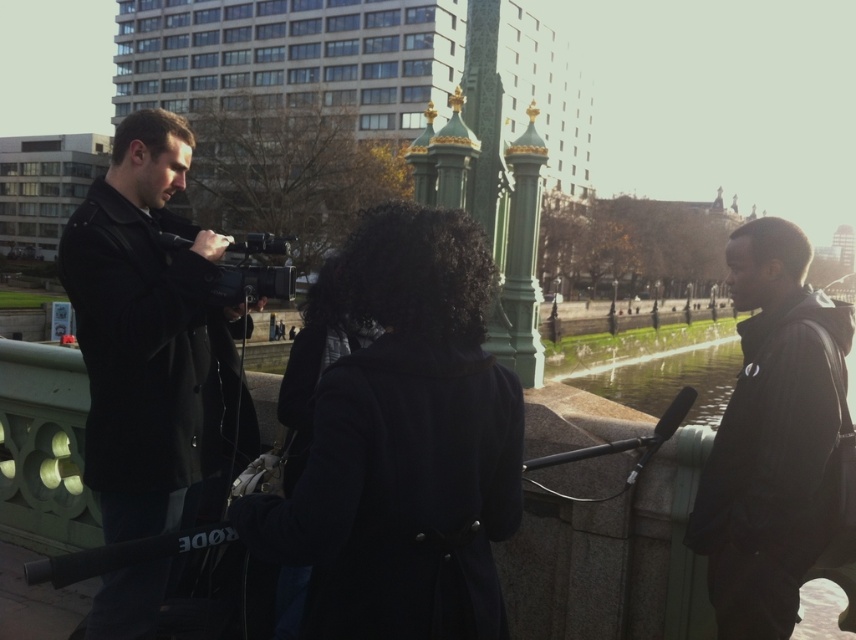
Can you confirm if black matte jacket at right is positioned to the left of black matte video camera at center?

No, black matte jacket at right is not to the left of black matte video camera at center.

Is point (736, 252) closer to camera compared to point (290, 237)?

That is True.

Where is `black matte jacket at right`? The height and width of the screenshot is (640, 856). black matte jacket at right is located at coordinates (771, 436).

Image resolution: width=856 pixels, height=640 pixels. I want to click on black matte jacket at right, so click(x=771, y=436).

Can you confirm if black leather jacket at left is taller than black matte video camera at center?

Correct, black leather jacket at left is much taller as black matte video camera at center.

Is point (181, 493) behind point (251, 288)?

That is True.

I want to click on black leather jacket at left, so click(x=147, y=333).

Does dark wool coat at center come in front of black matte jacket at right?

That is True.

Does dark wool coat at center appear under black matte jacket at right?

Indeed, dark wool coat at center is positioned under black matte jacket at right.

Who is more distant from viewer, (x=354, y=419) or (x=831, y=310)?

Point (x=831, y=310)

The height and width of the screenshot is (640, 856). I want to click on dark wool coat at center, so click(403, 445).